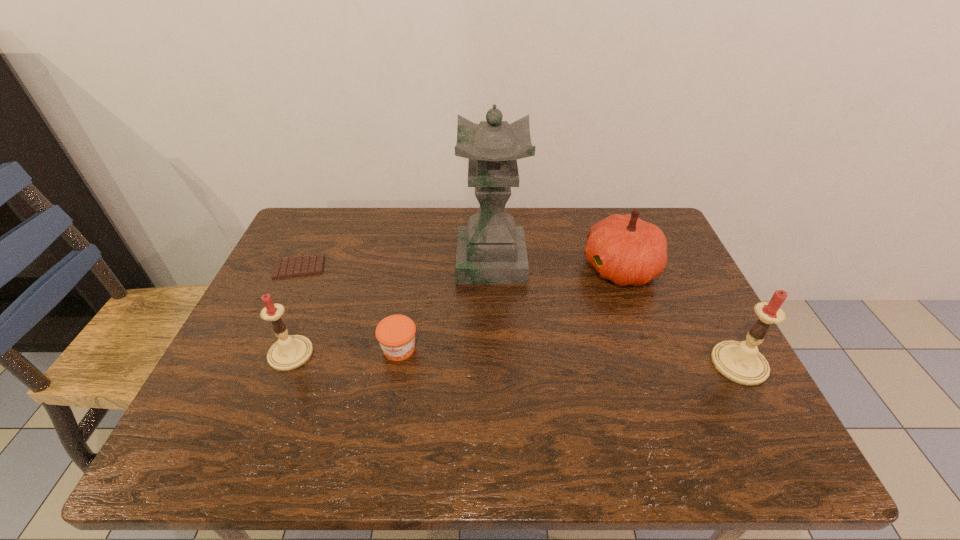
I want to click on free space located 0.300m on the back of the rightmost object, so click(684, 262).

Locate an element on the screen. The image size is (960, 540). free location located 0.350m on the front of the chocolate bar is located at coordinates (243, 387).

Find the location of a particular element. The width and height of the screenshot is (960, 540). free space located 0.230m at the front opening of the tallest object is located at coordinates (377, 261).

The height and width of the screenshot is (540, 960). What are the coordinates of `blank space located at the front opening of the tallest object` in the screenshot? It's located at (319, 261).

Image resolution: width=960 pixels, height=540 pixels. I want to click on free space located at the front opening of the tallest object, so click(x=416, y=261).

Where is `vacant area situated 0.180m on the front-facing side of the second object from right to left`? vacant area situated 0.180m on the front-facing side of the second object from right to left is located at coordinates (518, 268).

Locate an element on the screen. The width and height of the screenshot is (960, 540). vacant space located 0.090m on the front-facing side of the second object from right to left is located at coordinates (550, 268).

Where is `vacant point located 0.320m on the front-facing side of the second object from right to left`? vacant point located 0.320m on the front-facing side of the second object from right to left is located at coordinates (469, 268).

Image resolution: width=960 pixels, height=540 pixels. I want to click on vacant point located on the front label of the third object from left to right, so click(392, 392).

Identify the location of sculpture located at the far edge. The width and height of the screenshot is (960, 540). (490, 250).